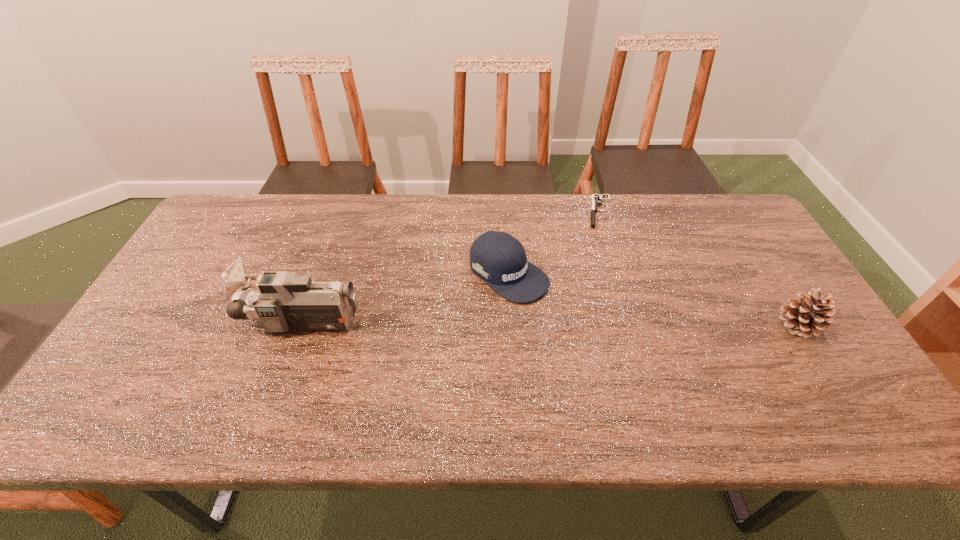
Where is `the tallest object`? This screenshot has height=540, width=960. the tallest object is located at coordinates (286, 301).

What are the coordinates of `the leftmost object` in the screenshot? It's located at pos(286,301).

Where is `the rightmost object`? This screenshot has height=540, width=960. the rightmost object is located at coordinates tap(807, 316).

The image size is (960, 540). I want to click on baseball cap, so click(x=498, y=258).

This screenshot has width=960, height=540. I want to click on the second object from left to right, so click(x=498, y=258).

In order to click on the shortest object in this screenshot , I will do `click(596, 200)`.

At what (x,y) coordinates should I click in order to perform the action: click on the farthest object. Please return your answer as a coordinate pair (x, y). This screenshot has width=960, height=540. Looking at the image, I should click on (596, 200).

Find the location of a particular element. free space located on the front-facing side of the leftmost object is located at coordinates (215, 322).

The image size is (960, 540). I want to click on free spot located on the front-facing side of the leftmost object, so click(x=184, y=322).

Find the location of `vacant space located 0.080m on the front-facing side of the leftmost object`. vacant space located 0.080m on the front-facing side of the leftmost object is located at coordinates (215, 322).